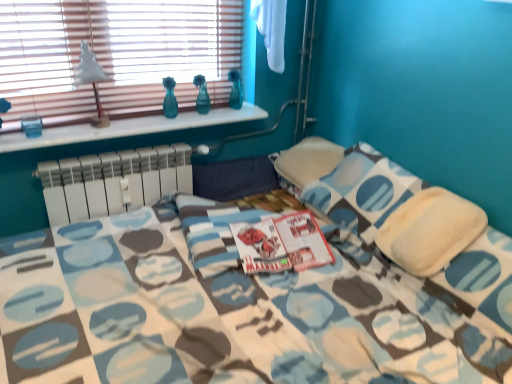
Question: From a real-world perspective, is wooden blinds at upper left physically located above or below white marble window sill at upper left?

Choices:
 (A) below
 (B) above

Answer: (B)

Question: Do you think wooden blinds at upper left is within white marble window sill at upper left, or outside of it?

Choices:
 (A) inside
 (B) outside

Answer: (B)

Question: Which object is the closest to the wooden blinds at upper left?

Choices:
 (A) white plastic radiator at center
 (B) soft white pillow at center
 (C) white matte table lamp at upper left
 (D) white marble window sill at upper left

Answer: (C)

Question: Based on their relative distances, which object is farther from the white matte table lamp at upper left?

Choices:
 (A) white plastic radiator at center
 (B) soft white pillow at center
 (C) white marble window sill at upper left
 (D) wooden blinds at upper left

Answer: (B)